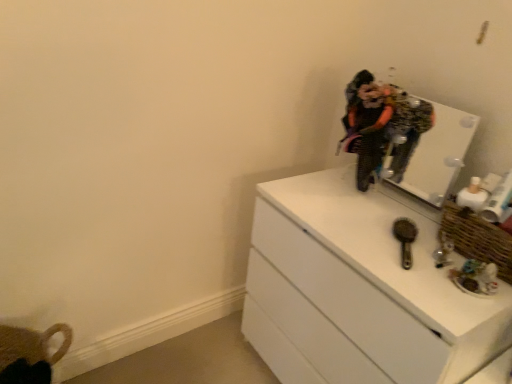
You are a GUI agent. You are given a task and a screenshot of the screen. Output one action in this format:
    pyautogui.click(x=<x>, y=<y>)
    Task: Click on the free region on the left part of metallic brown brush at center-right
    The height and width of the screenshot is (384, 512).
    Given the screenshot: What is the action you would take?
    pyautogui.click(x=352, y=239)